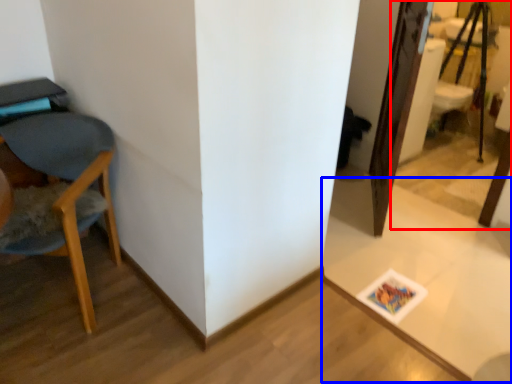
Question: Which object appears farthest to the camera in this image, mirror (highlighted by a red box) or table (highlighted by a blue box)?

Choices:
 (A) mirror
 (B) table

Answer: (A)